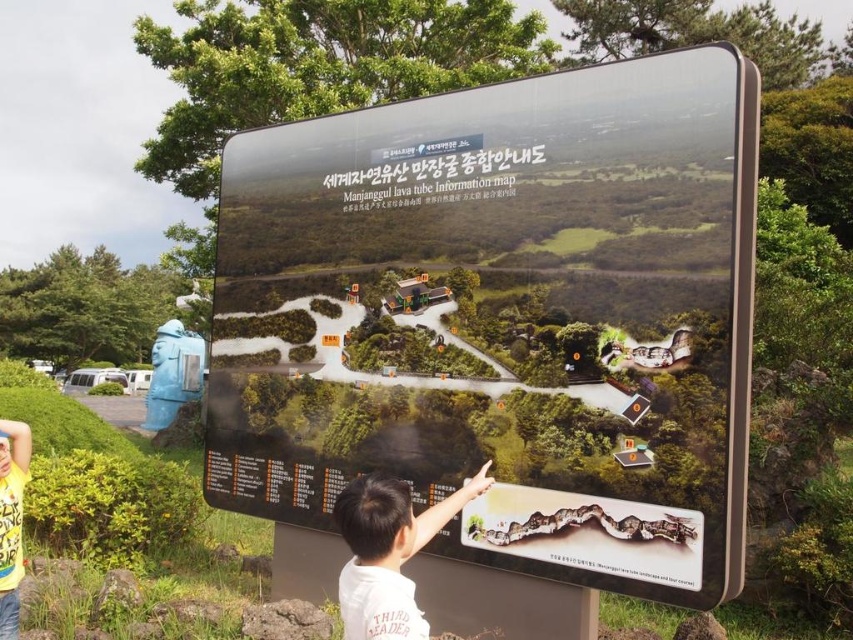
Question: Is glossy plastic billboard at center thinner than yellow t-shirt at lower left?

Choices:
 (A) yes
 (B) no

Answer: (B)

Question: Which point is closer to the camera?

Choices:
 (A) (543, 465)
 (B) (16, 440)

Answer: (A)

Question: Is glossy plastic billboard at center below white cotton shirt at center?

Choices:
 (A) yes
 (B) no

Answer: (B)

Question: Which object is the farthest from the yellow t-shirt at lower left?

Choices:
 (A) glossy plastic billboard at center
 (B) white cotton shirt at center

Answer: (A)

Question: Which object appears closest to the camera in this image?

Choices:
 (A) white cotton shirt at center
 (B) yellow t-shirt at lower left

Answer: (A)

Question: Is glossy plastic billboard at center further to camera compared to white cotton shirt at center?

Choices:
 (A) no
 (B) yes

Answer: (B)